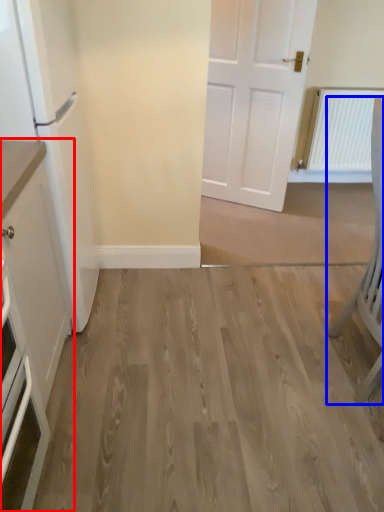
Question: Which of the following is the closest to the observer, cabinetry (highlighted by a red box) or chair (highlighted by a blue box)?

Choices:
 (A) cabinetry
 (B) chair

Answer: (A)